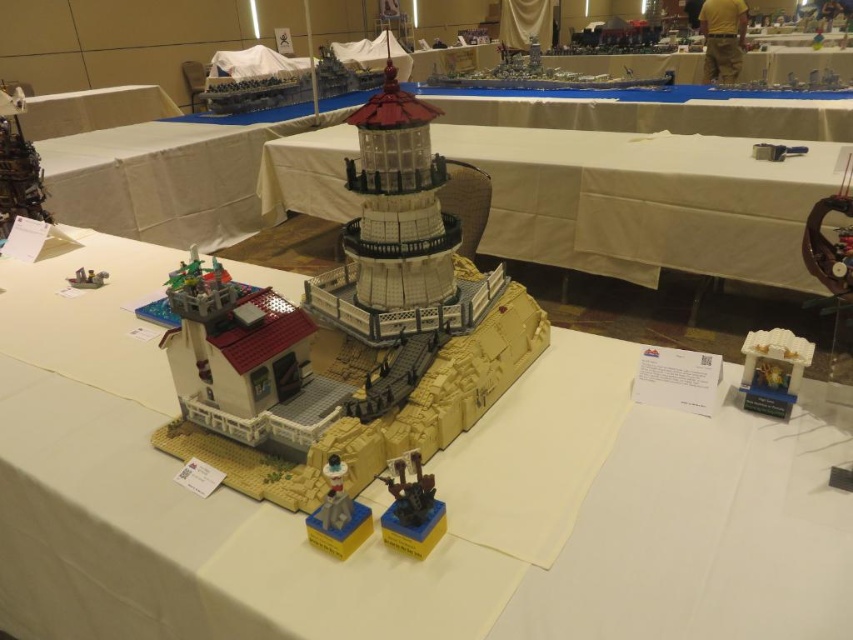
You are a photographer standing at a certain distance from the white matte lego lighthouse at center. If your camera can focus on objects up to 30 inches away, will it be able to focus on the lighthouse?

The white matte lego lighthouse at center is 31.60 inches away from the camera, which is beyond the camera focus range of 30 inches. Therefore, the camera will not be able to focus on the lighthouse.

You are standing at the base of the LEGO lighthouse and see two points marked in the scene. The first point is at coordinates point (602, 396), and the second is at point (128, 122). Which point is closer to you as you face the lighthouse?

Point (602, 396) is closer to you because it is in front of point (128, 122) when facing the lighthouse.

You are organizing a LEGO display and want to ensure that the white matte lego lighthouse at center is visible from the entrance, which is near the white fabric table at upper left. Based on their positions, will the lighthouse be visible from the table? Explain your reasoning.

The white matte lego lighthouse at center is located below the white fabric table at upper left. Since the lighthouse is positioned lower than the table, it should be visible from the table as long as there are no obstructions between them.